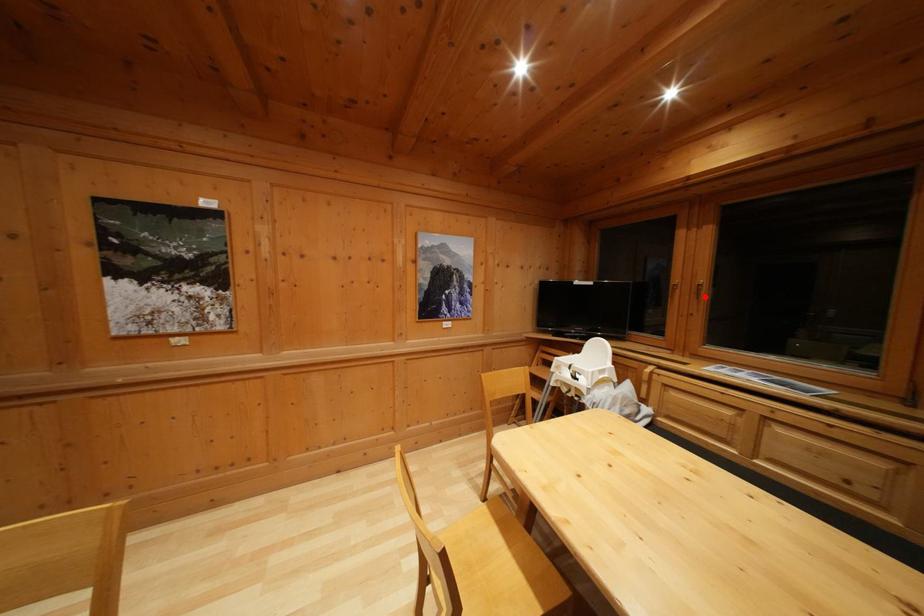
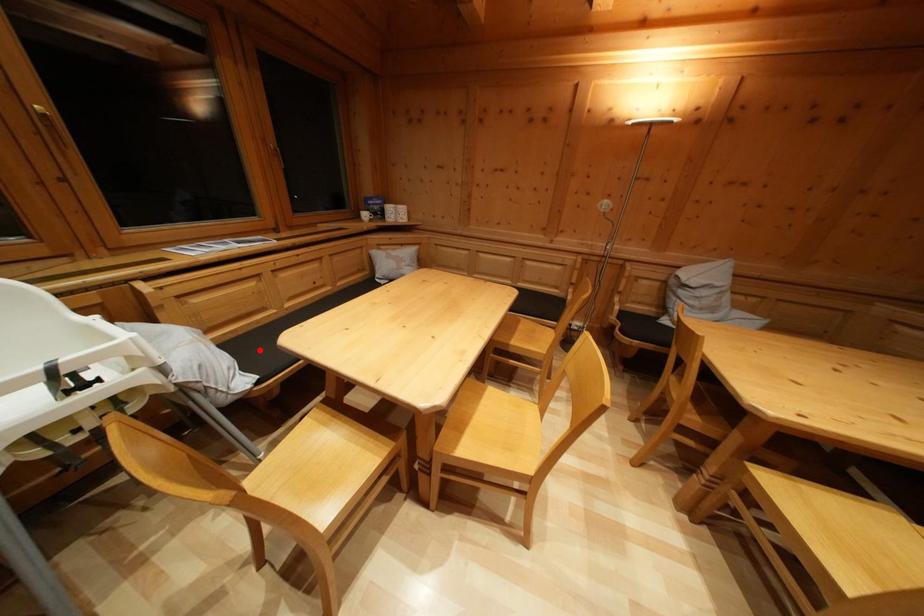
I am providing you with two images of the same scene from different viewpoints. A red point is marked on the first image and another point is marked on the second image. Is the marked point in image1 the same physical position as the marked point in image2?

No